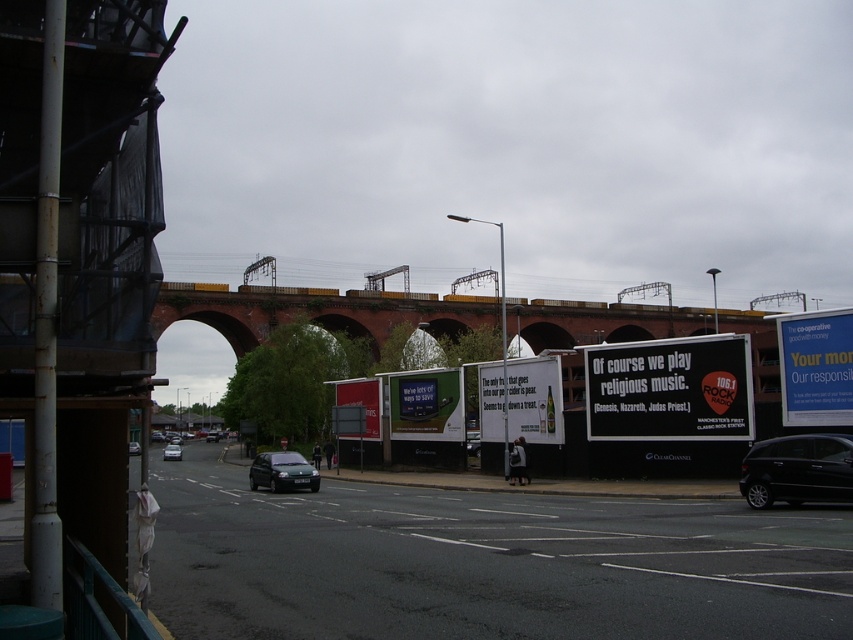
Question: Which point is farther from the camera taking this photo?

Choices:
 (A) (763, 506)
 (B) (259, 460)
 (C) (132, 442)
 (D) (509, 381)

Answer: (C)

Question: Is brick arch bridge at center positioned behind metallic silver billboard at center?

Choices:
 (A) yes
 (B) no

Answer: (B)

Question: Does white paper billboard at center have a greater width compared to dark green matte hatchback at center?

Choices:
 (A) yes
 (B) no

Answer: (B)

Question: Observing the image, what is the correct spatial positioning of shiny black car at lower right in reference to silver metallic sedan at center?

Choices:
 (A) left
 (B) right

Answer: (B)

Question: Estimate the real-world distances between objects in this image. Which object is farther from the black matte billboard at center?

Choices:
 (A) blue paperboard billboard at right
 (B) metallic silver billboard at center
 (C) white paper billboard at center
 (D) silver metallic sedan at center

Answer: (D)

Question: Estimate the real-world distances between objects in this image. Which object is closer to the shiny black car at lower right?

Choices:
 (A) dark green matte hatchback at center
 (B) brick arch bridge at center

Answer: (A)